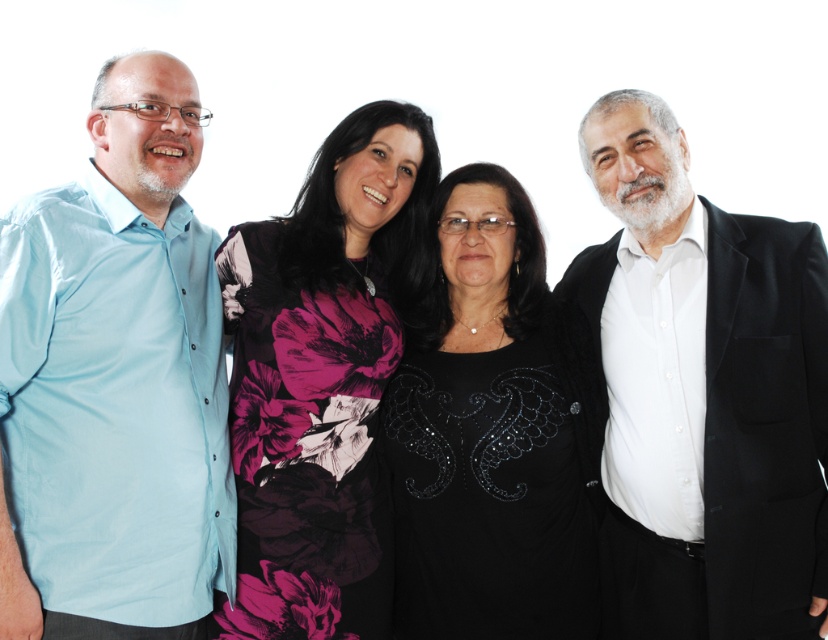
Is black satin suit at right further to camera compared to black sequined dress at center?

No, it is in front of black sequined dress at center.

Does point (757, 413) lie behind point (554, 561)?

No, (757, 413) is closer to viewer.

Which is in front, point (672, 381) or point (455, 364)?

Point (672, 381) is in front.

In order to click on black satin suit at right in this screenshot , I will do `click(704, 392)`.

Can you confirm if light blue cotton shirt at left is positioned to the right of black satin suit at right?

Incorrect, light blue cotton shirt at left is not on the right side of black satin suit at right.

Can you confirm if light blue cotton shirt at left is positioned to the left of black satin suit at right?

Indeed, light blue cotton shirt at left is positioned on the left side of black satin suit at right.

Is point (225, 504) positioned behind point (774, 292)?

That is True.

Where is `light blue cotton shirt at left`? Image resolution: width=828 pixels, height=640 pixels. light blue cotton shirt at left is located at coordinates 114,380.

Between point (68, 257) and point (266, 508), which one is positioned behind?

Positioned behind is point (266, 508).

From the picture: Which of these two, light blue cotton shirt at left or floral-patterned dress at center, stands taller?

floral-patterned dress at center

Who is more distant from viewer, [61,221] or [364,124]?

Positioned behind is point [364,124].

Image resolution: width=828 pixels, height=640 pixels. I want to click on light blue cotton shirt at left, so click(x=114, y=380).